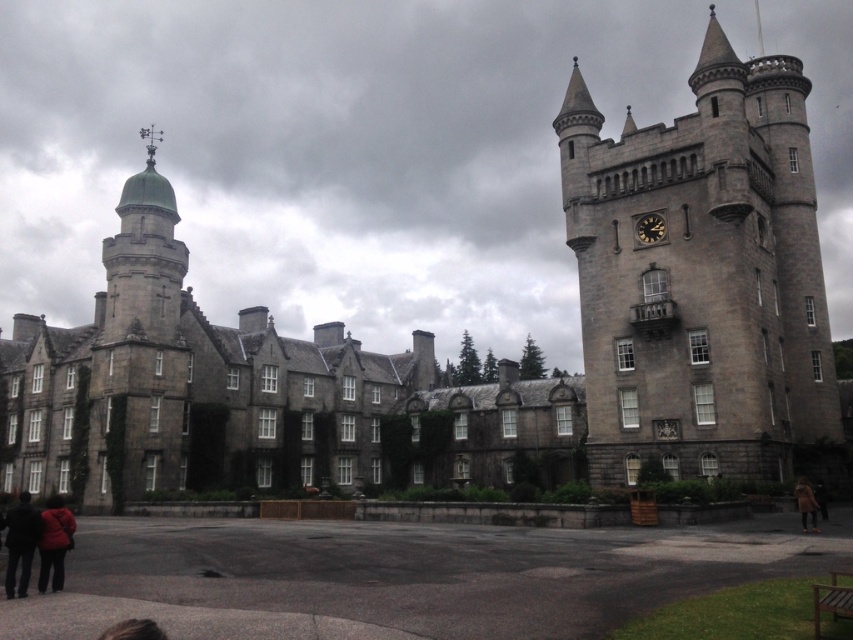
Question: Which point is farther to the camera?

Choices:
 (A) (816, 499)
 (B) (24, 532)
 (C) (579, 193)

Answer: (C)

Question: Which object appears farthest from the camera in this image?

Choices:
 (A) brown fuzzy coat at lower right
 (B) black metal clock at center
 (C) dark gray stone tower at right

Answer: (B)

Question: Which object appears farthest from the camera in this image?

Choices:
 (A) brown fuzzy coat at lower right
 (B) brown leather jacket at lower right

Answer: (B)

Question: Where is dark fabric jacket at lower left located in relation to brown fuzzy coat at lower right in the image?

Choices:
 (A) left
 (B) right

Answer: (A)

Question: From the image, what is the correct spatial relationship of dark gray stone tower at right in relation to dark fabric jacket at lower left?

Choices:
 (A) below
 (B) above

Answer: (B)

Question: Is matte red coat at lower left above black metal clock at center?

Choices:
 (A) no
 (B) yes

Answer: (A)